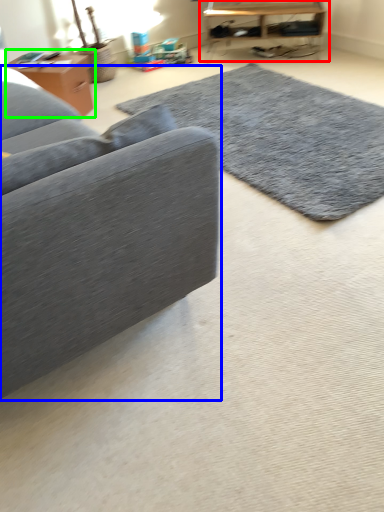
Question: Considering the real-world distances, which object is farthest from table (highlighted by a red box)? studio couch (highlighted by a blue box) or table (highlighted by a green box)?

Choices:
 (A) studio couch
 (B) table

Answer: (A)